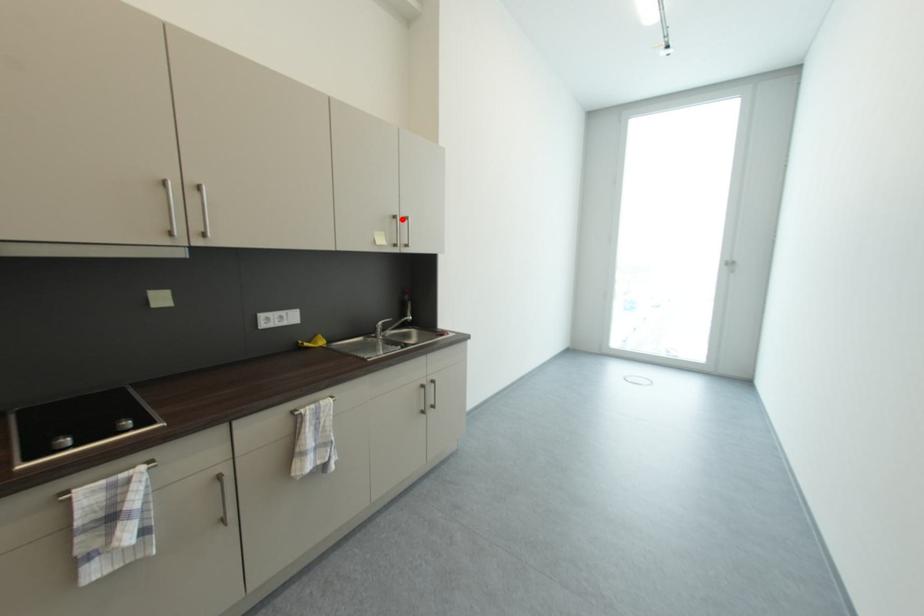
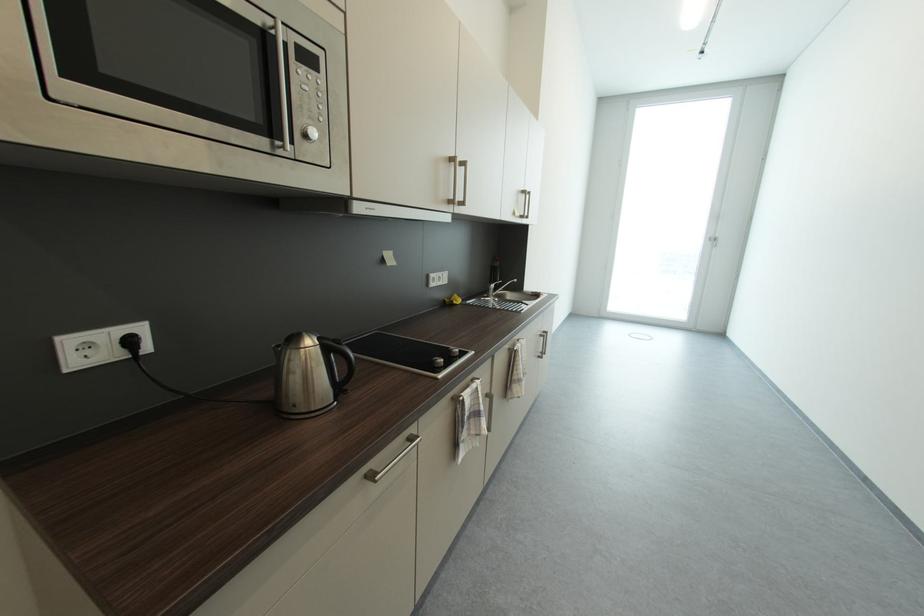
Where in the second image is the point corresponding to the highlighted location from the first image?

(529, 193)